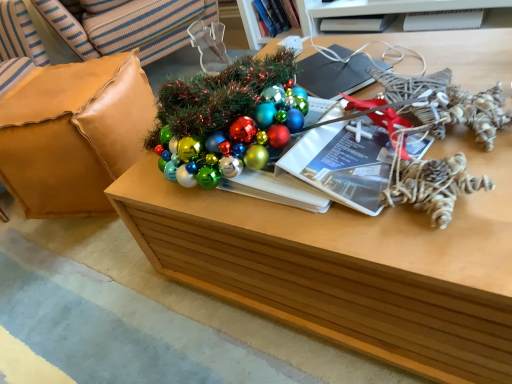
What do you see at coordinates (276, 16) in the screenshot? Image resolution: width=512 pixels, height=384 pixels. I see `hardcover book at upper center, the 1th book viewed from the left` at bounding box center [276, 16].

The width and height of the screenshot is (512, 384). I want to click on twisted rope ornament at right, so click(x=433, y=186).

At what (x,y) coordinates should I click in order to perform the action: click on white matte book at upper center, which appears as the second book when viewed from the left. Please return your answer as a coordinate pair (x, y). The image size is (512, 384). Looking at the image, I should click on (357, 23).

Image resolution: width=512 pixels, height=384 pixels. Describe the element at coordinates (343, 164) in the screenshot. I see `matte paper magazine at center, which is counted as the 1th magazine, starting from the front` at that location.

Locate an element on the screen. This screenshot has height=384, width=512. wooden table at center is located at coordinates (349, 264).

Considering the points (378, 64) and (335, 133), which point is behind, point (378, 64) or point (335, 133)?

The point (378, 64) is farther.

From the image's perspective, is black matte magazine at upper center, placed as the second magazine when sorted from bottom to top, over matte paper magazine at center, marked as the first magazine in a bottom-to-top arrangement?

Indeed, from the image's perspective, black matte magazine at upper center, placed as the second magazine when sorted from bottom to top, is shown above matte paper magazine at center, marked as the first magazine in a bottom-to-top arrangement.

You are a GUI agent. You are given a task and a screenshot of the screen. Output one action in this format:
    pyautogui.click(x=<x>, y=<y>)
    Task: Click on the magazine that appears above the black matte magazine at upper center, the second magazine from the back (from a real-world perspective)
    
    Given the screenshot: What is the action you would take?
    pyautogui.click(x=343, y=164)

Is black matte magazine at upper center, which is the second magazine in right-to-left order, located outside matte paper magazine at center, marked as the first magazine in a bottom-to-top arrangement?

black matte magazine at upper center, which is the second magazine in right-to-left order, lies outside matte paper magazine at center, marked as the first magazine in a bottom-to-top arrangement,'s area.

From the image's perspective, is matte paper magazine at center, which is counted as the 1th magazine, starting from the front, below hardcover book at upper center, which is the second book in right-to-left order?

Yes, from the image's perspective, matte paper magazine at center, which is counted as the 1th magazine, starting from the front, is below hardcover book at upper center, which is the second book in right-to-left order.

Considering the relative sizes of matte paper magazine at center, which is the third magazine in top-to-bottom order, and hardcover book at upper center, which is the second book in right-to-left order, in the image provided, is matte paper magazine at center, which is the third magazine in top-to-bottom order, thinner than hardcover book at upper center, which is the second book in right-to-left order,?

In fact, matte paper magazine at center, which is the third magazine in top-to-bottom order, might be wider than hardcover book at upper center, which is the second book in right-to-left order.

Would you say hardcover book at upper center, which is the second book in right-to-left order, is part of matte paper magazine at center, which is the third magazine in top-to-bottom order,'s contents?

No, hardcover book at upper center, which is the second book in right-to-left order, is not inside matte paper magazine at center, which is the third magazine in top-to-bottom order.

Could you tell me if leather cushion at left is turned towards white matte book at upper center, acting as the first book starting from the right?

No, leather cushion at left is not facing towards white matte book at upper center, acting as the first book starting from the right.

From the image's perspective, who appears lower, leather cushion at left or white matte book at upper center, acting as the first book starting from the right?

leather cushion at left is shown below in the image.

Consider the image. Which point is more forward, (83,100) or (333,32)?

The point (83,100) is in front.

Which is behind, leather cushion at left or white matte book at upper center, which appears as the second book when viewed from the left?

white matte book at upper center, which appears as the second book when viewed from the left, is more distant.

Considering the relative positions of twisted rope ornament at right and matte paper magazine at center, marked as the first magazine in a bottom-to-top arrangement, in the image provided, is twisted rope ornament at right in front of matte paper magazine at center, marked as the first magazine in a bottom-to-top arrangement,?

That is True.

Between twisted rope ornament at right and matte paper magazine at center, which is counted as the third magazine, starting from the right, which one has larger width?

matte paper magazine at center, which is counted as the third magazine, starting from the right.

Is twisted rope ornament at right directly adjacent to matte paper magazine at center, arranged as the 1th magazine when viewed from the left?

Indeed, twisted rope ornament at right and matte paper magazine at center, arranged as the 1th magazine when viewed from the left, are beside each other and touching.

Considering the sizes of objects matte paper magazine at center, which ranks as the third magazine in back-to-front order, and black matte magazine at upper center, the 2th magazine from the left, in the image provided, who is bigger, matte paper magazine at center, which ranks as the third magazine in back-to-front order, or black matte magazine at upper center, the 2th magazine from the left,?

matte paper magazine at center, which ranks as the third magazine in back-to-front order.

Considering the sizes of objects matte paper magazine at center, which is counted as the 1th magazine, starting from the front, and black matte magazine at upper center, the second magazine from the back, in the image provided, who is taller, matte paper magazine at center, which is counted as the 1th magazine, starting from the front, or black matte magazine at upper center, the second magazine from the back,?

With more height is matte paper magazine at center, which is counted as the 1th magazine, starting from the front.

Which of these two, matte paper magazine at center, arranged as the 1th magazine when viewed from the left, or black matte magazine at upper center, placed as the second magazine when sorted from bottom to top, is thinner?

black matte magazine at upper center, placed as the second magazine when sorted from bottom to top.

Looking at this image, which object is closer to the camera taking this photo, matte paper magazine at center, which is the third magazine in top-to-bottom order, or black matte magazine at upper center, placed as the second magazine when sorted from bottom to top?

matte paper magazine at center, which is the third magazine in top-to-bottom order, is more forward.

Which of these two, wooden table at center or black matte magazine at upper center, the 2th magazine from the left, stands shorter?

With less height is black matte magazine at upper center, the 2th magazine from the left.

Based on their sizes in the image, would you say wooden table at center is bigger or smaller than black matte magazine at upper center, the second magazine in the top-to-bottom sequence?

wooden table at center is bigger than black matte magazine at upper center, the second magazine in the top-to-bottom sequence.

From a real-world perspective, is wooden table at center above or below black matte magazine at upper center, the 2th magazine from the left?

Result: Clearly, from a real-world perspective, wooden table at center is below black matte magazine at upper center, the 2th magazine from the left.

Is hardcover book at upper center, the 1th book viewed from the left, positioned with its back to white plastic magazine at upper right, the 1th magazine from the right?

No, hardcover book at upper center, the 1th book viewed from the left,'s orientation is not away from white plastic magazine at upper right, the 1th magazine from the right.

Would you say hardcover book at upper center, the 1th book viewed from the left, is outside white plastic magazine at upper right, the first magazine viewed from the top?

Yes.

Is hardcover book at upper center, which is the second book in right-to-left order, at the left side of white plastic magazine at upper right, the 1th magazine from the right?

Correct, you'll find hardcover book at upper center, which is the second book in right-to-left order, to the left of white plastic magazine at upper right, the 1th magazine from the right.

Looking at this image, from a real-world perspective, which object rests below the other?

In real-world perspective, white plastic magazine at upper right, acting as the 1th magazine starting from the back, is lower.

The image size is (512, 384). Identify the location of magazine below the black matte magazine at upper center, the second magazine from the back (from the image's perspective). [343, 164].

From a real-world perspective, count 1st books downward from the matte paper magazine at center, marked as the first magazine in a bottom-to-top arrangement, and point to it. Please provide its 2D coordinates.

[(276, 16)]

Based on their spatial positions, is matte paper magazine at center, arranged as the 1th magazine when viewed from the left, or hardcover book at upper center, the 1th book viewed from the left, further from wooden table at center?

Based on the image, hardcover book at upper center, the 1th book viewed from the left, appears to be further to wooden table at center.

Which object lies further to the anchor point leather cushion at left, white matte book at upper center, which appears as the second book when viewed from the left, or hardcover book at upper center, which is the second book in right-to-left order?

white matte book at upper center, which appears as the second book when viewed from the left, lies further to leather cushion at left than the other object.

When comparing their distances from white plastic magazine at upper right, acting as the 3th magazine starting from the left, does hardcover book at upper center, which is the second book in right-to-left order, or leather cushion at left seem further?

leather cushion at left is further to white plastic magazine at upper right, acting as the 3th magazine starting from the left.

When comparing their distances from white matte book at upper center, which appears as the second book when viewed from the left, does matte paper magazine at center, which is counted as the third magazine, starting from the right, or leather cushion at left seem further?

Among the two, matte paper magazine at center, which is counted as the third magazine, starting from the right, is located further to white matte book at upper center, which appears as the second book when viewed from the left.

Which object lies nearer to the anchor point white matte book at upper center, which appears as the second book when viewed from the left, hardcover book at upper center, the 1th book viewed from the left, or black matte magazine at upper center, the 2th magazine from the left?

hardcover book at upper center, the 1th book viewed from the left, is positioned closer to the anchor white matte book at upper center, which appears as the second book when viewed from the left.

Looking at the image, which one is located further to leather cushion at left, matte paper magazine at center, which ranks as the third magazine in back-to-front order, or white plastic magazine at upper right, which is counted as the third magazine, starting from the front?

Based on the image, white plastic magazine at upper right, which is counted as the third magazine, starting from the front, appears to be further to leather cushion at left.

From the picture: From the image, which object appears to be farther from wooden table at center, white plastic magazine at upper right, the first magazine viewed from the top, or twisted rope ornament at right?

white plastic magazine at upper right, the first magazine viewed from the top, lies further to wooden table at center than the other object.

When comparing their distances from white plastic magazine at upper right, the 1th magazine from the right, does matte paper magazine at center, which is counted as the third magazine, starting from the right, or leather cushion at left seem further?

leather cushion at left.

At what (x,y) coordinates should I click in order to perform the action: click on armchair positioned between twisted rope ornament at right and hardcover book at upper center, the 1th book viewed from the left, from near to far. Please return your answer as a coordinate pair (x, y). The height and width of the screenshot is (384, 512). Looking at the image, I should click on (74, 134).

I want to click on book positioned between wooden table at center and hardcover book at upper center, which is the second book in right-to-left order, from near to far, so click(x=357, y=23).

Where is `armchair between matte paper magazine at center, which is counted as the third magazine, starting from the right, and white matte book at upper center, acting as the first book starting from the right, along the z-axis`? armchair between matte paper magazine at center, which is counted as the third magazine, starting from the right, and white matte book at upper center, acting as the first book starting from the right, along the z-axis is located at coordinates (74, 134).

This screenshot has width=512, height=384. What are the coordinates of `magazine between leather cushion at left and black matte magazine at upper center, which is the second magazine in right-to-left order, in the horizontal direction` in the screenshot? It's located at (343, 164).